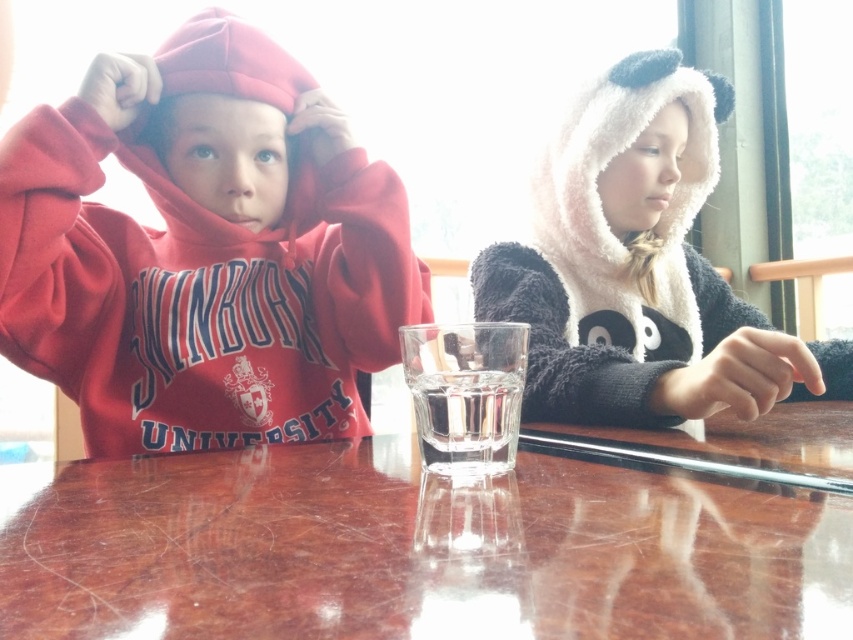
Question: Estimate the real-world distances between objects in this image. Which object is closer to the matte red hoodie at left?

Choices:
 (A) glossy brown table at center
 (B) transparent glass at center

Answer: (A)

Question: Observing the image, what is the correct spatial positioning of glossy brown table at center in reference to matte red hoodie at left?

Choices:
 (A) right
 (B) left

Answer: (A)

Question: From the image, what is the correct spatial relationship of glossy brown table at center in relation to transparent glass at center?

Choices:
 (A) above
 (B) below

Answer: (B)

Question: Considering the real-world distances, which object is farthest from the fuzzy white hood at upper right?

Choices:
 (A) transparent glass at center
 (B) matte red hoodie at left
 (C) glossy brown table at center

Answer: (A)

Question: Can you confirm if glossy brown table at center is wider than matte red hoodie at left?

Choices:
 (A) no
 (B) yes

Answer: (B)

Question: Which object is the farthest from the glossy brown table at center?

Choices:
 (A) matte red hoodie at left
 (B) transparent glass at center
 (C) fuzzy white hood at upper right

Answer: (A)